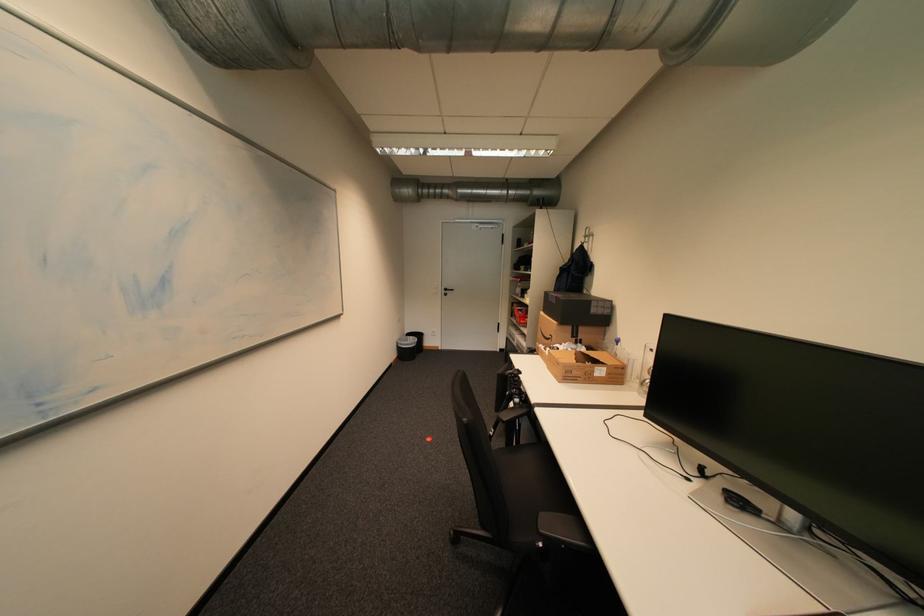
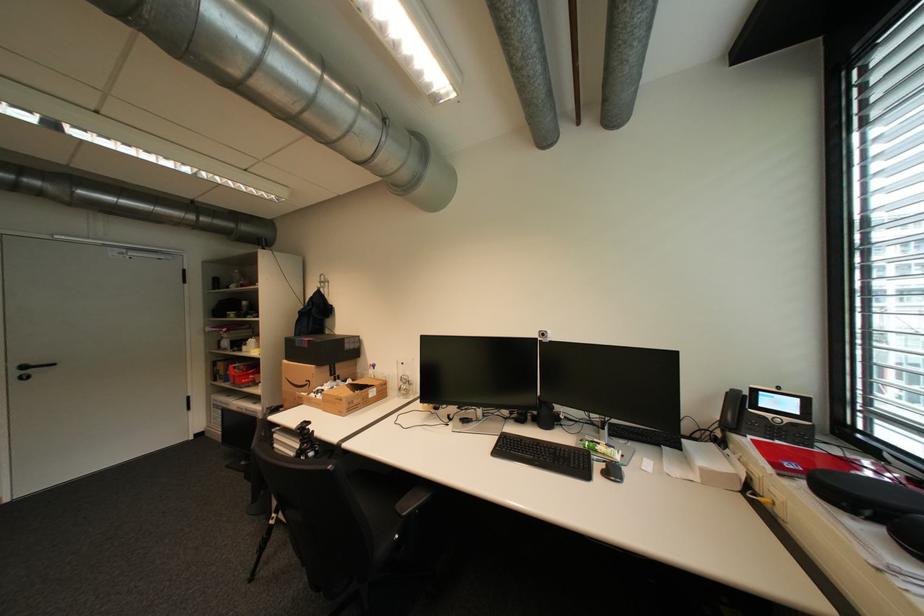
Question: The camera is either moving clockwise (left) or counter-clockwise (right) around the object. The first image is from the beginning of the video and the second image is from the end. Is the camera moving left or right when shooting the video?

Choices:
 (A) Left
 (B) Right

Answer: (A)